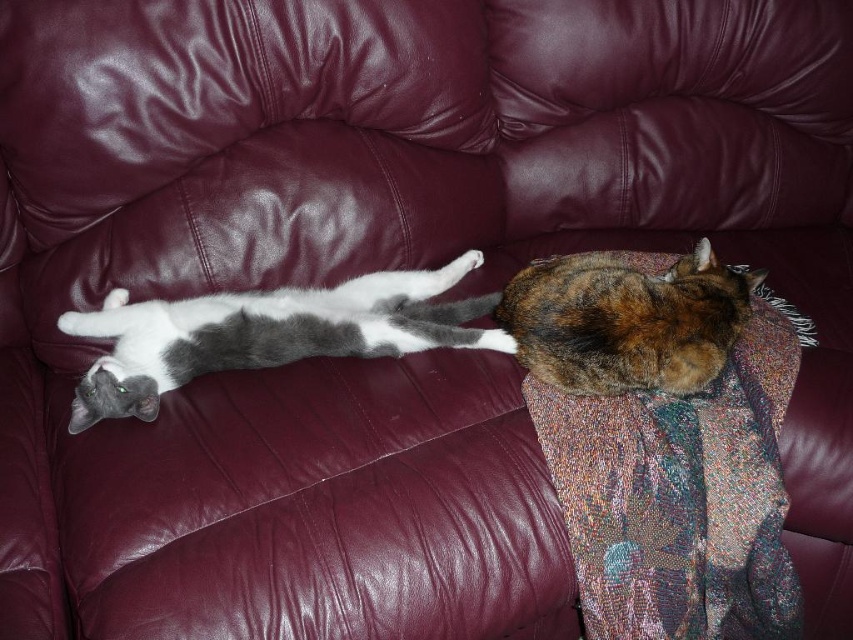
Question: Observing the image, what is the correct spatial positioning of white-gray fur cat at left in reference to calico fur cat at right?

Choices:
 (A) above
 (B) below

Answer: (B)

Question: Which of the following is the farthest from the observer?

Choices:
 (A) calico fur cat at right
 (B) white-gray fur cat at left

Answer: (A)

Question: Which point appears farthest from the camera in this image?

Choices:
 (A) (602, 253)
 (B) (267, 292)

Answer: (A)

Question: Is white-gray fur cat at left to the left of calico fur cat at right from the viewer's perspective?

Choices:
 (A) yes
 (B) no

Answer: (A)

Question: Does white-gray fur cat at left have a greater width compared to calico fur cat at right?

Choices:
 (A) yes
 (B) no

Answer: (A)

Question: Which object appears closest to the camera in this image?

Choices:
 (A) calico fur cat at right
 (B) white-gray fur cat at left

Answer: (B)